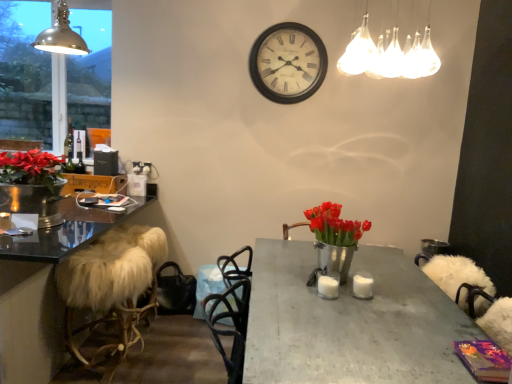
I want to click on free space behind white matte candle at table center, which appears as the second candle when viewed from the left, so click(358, 273).